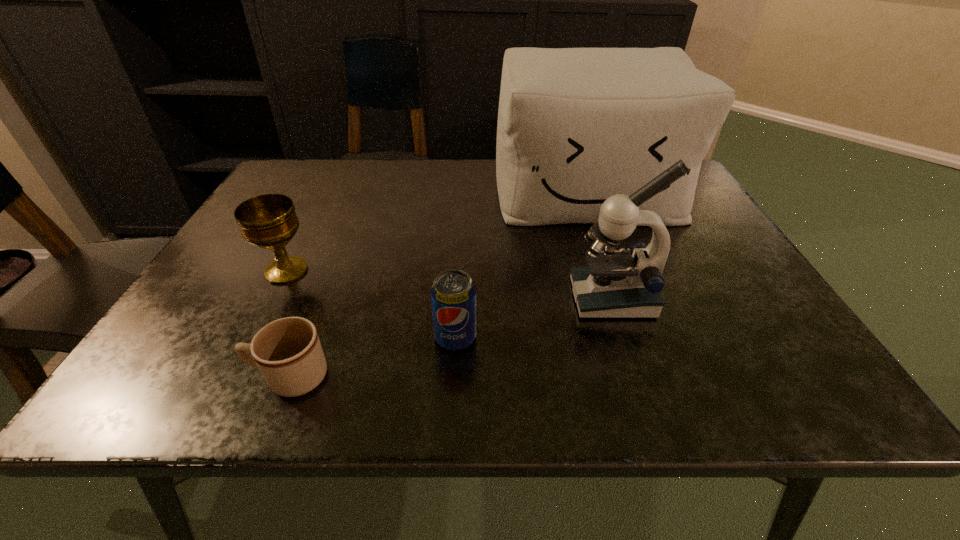
At what (x,y) coordinates should I click in order to perform the action: click on object positioned at the right edge. Please return your answer as a coordinate pair (x, y). This screenshot has width=960, height=540. Looking at the image, I should click on (576, 126).

Locate an element on the screen. The image size is (960, 540). object situated at the far right corner is located at coordinates (576, 126).

You are a GUI agent. You are given a task and a screenshot of the screen. Output one action in this format:
    pyautogui.click(x=<x>, y=<y>)
    Task: Click on the vacant position at the far edge of the desktop
    
    Given the screenshot: What is the action you would take?
    pyautogui.click(x=349, y=163)

I want to click on vacant region at the near edge, so click(x=226, y=399).

Locate an element on the screen. The height and width of the screenshot is (540, 960). vacant space at the left edge of the desktop is located at coordinates (196, 322).

Locate an element on the screen. Image resolution: width=960 pixels, height=540 pixels. vacant space at the right edge of the desktop is located at coordinates (717, 290).

The image size is (960, 540). What are the coordinates of `free space at the near left corner of the desktop` in the screenshot? It's located at (212, 367).

You are a GUI agent. You are given a task and a screenshot of the screen. Output one action in this format:
    pyautogui.click(x=<x>, y=<y>)
    Task: Click on the vacant region at the near right corner of the desktop
    
    Given the screenshot: What is the action you would take?
    pyautogui.click(x=774, y=363)

The width and height of the screenshot is (960, 540). Find the location of `vacant area that lies between the third object from left to right and the chalice`. vacant area that lies between the third object from left to right and the chalice is located at coordinates (371, 304).

At what (x,y) coordinates should I click in order to perform the action: click on empty location between the fourth shortest object and the soda. Please return your answer as a coordinate pair (x, y). This screenshot has height=540, width=960. Looking at the image, I should click on pos(534,318).